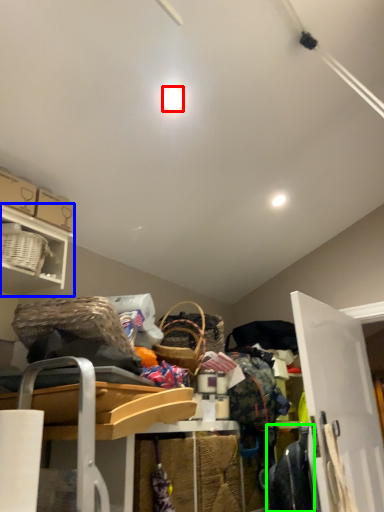
Question: Considering the real-world distances, which object is farthest from light (highlighted by a red box)? shelf (highlighted by a blue box) or clothing (highlighted by a green box)?

Choices:
 (A) shelf
 (B) clothing

Answer: (B)